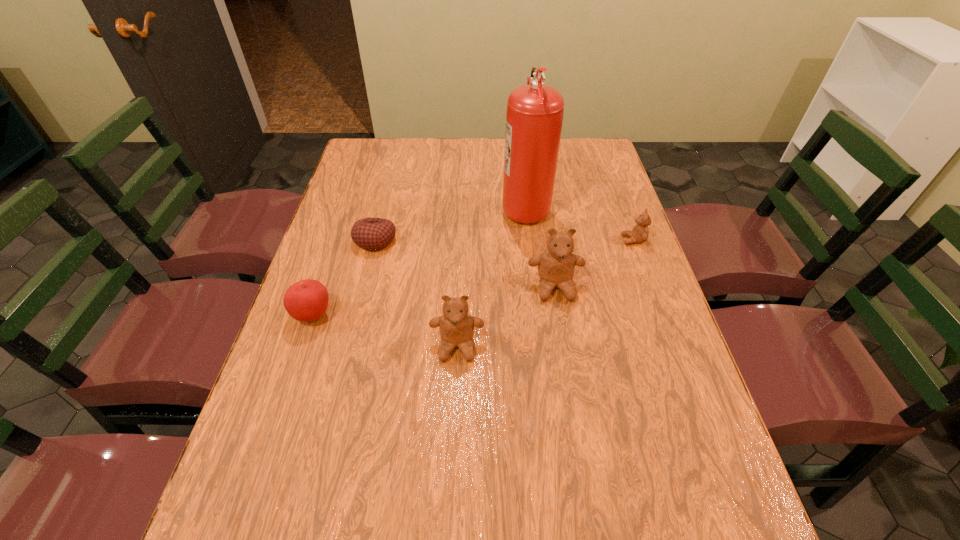
Locate an element on the screen. empty space between the second farthest teddy bear and the farthest teddy bear is located at coordinates (594, 264).

At what (x,y) coordinates should I click in order to perform the action: click on blank region between the second farthest teddy bear and the apple. Please return your answer as a coordinate pair (x, y). Looking at the image, I should click on (434, 301).

Image resolution: width=960 pixels, height=540 pixels. Identify the location of blank region between the second teddy bear from right to left and the leftmost teddy bear. pyautogui.click(x=506, y=316).

Find the location of `object that ranks as the fourth closest to the second nearest teddy bear`. object that ranks as the fourth closest to the second nearest teddy bear is located at coordinates (373, 234).

Select which object is the fourth closest to the shortest object. Please provide its 2D coordinates. Your answer should be formatted as a tuple, i.e. [(x, y)], where the tuple contains the x and y coordinates of a point satisfying the conditions above.

[(556, 266)]

Identify which teddy bear is the closest to the apple. Please provide its 2D coordinates. Your answer should be formatted as a tuple, i.e. [(x, y)], where the tuple contains the x and y coordinates of a point satisfying the conditions above.

[(456, 326)]

Where is `the second closest teddy bear relative to the shortest object`? This screenshot has height=540, width=960. the second closest teddy bear relative to the shortest object is located at coordinates (556, 266).

Locate an element on the screen. The height and width of the screenshot is (540, 960). vacant space that satisfies the following two spatial constraints: 1. on the instruction side of the tallest object; 2. on the face of the third object from left to right is located at coordinates (541, 346).

Image resolution: width=960 pixels, height=540 pixels. Find the location of `blank space that satisfies the following two spatial constraints: 1. on the instruction side of the fire extinguisher; 2. on the face of the nearest teddy bear`. blank space that satisfies the following two spatial constraints: 1. on the instruction side of the fire extinguisher; 2. on the face of the nearest teddy bear is located at coordinates (541, 346).